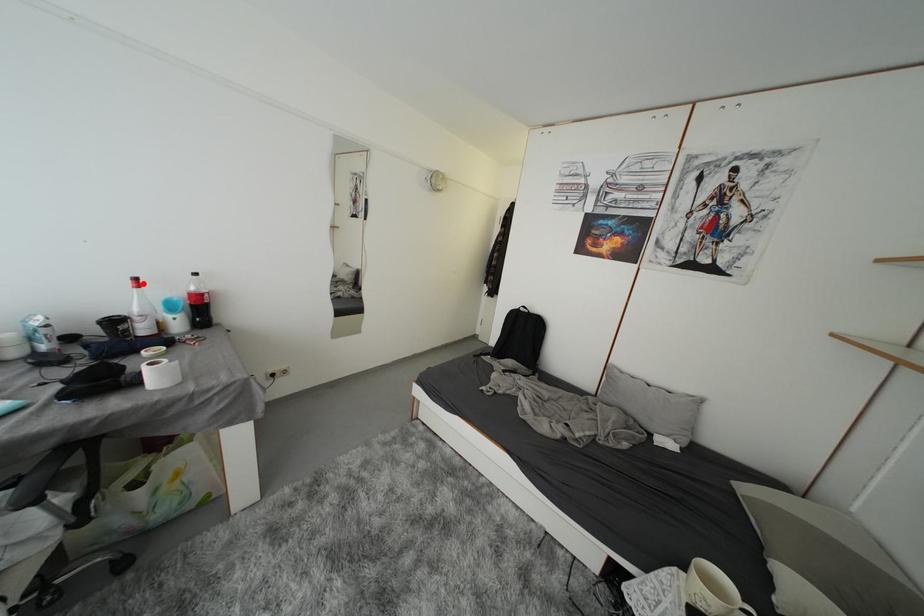
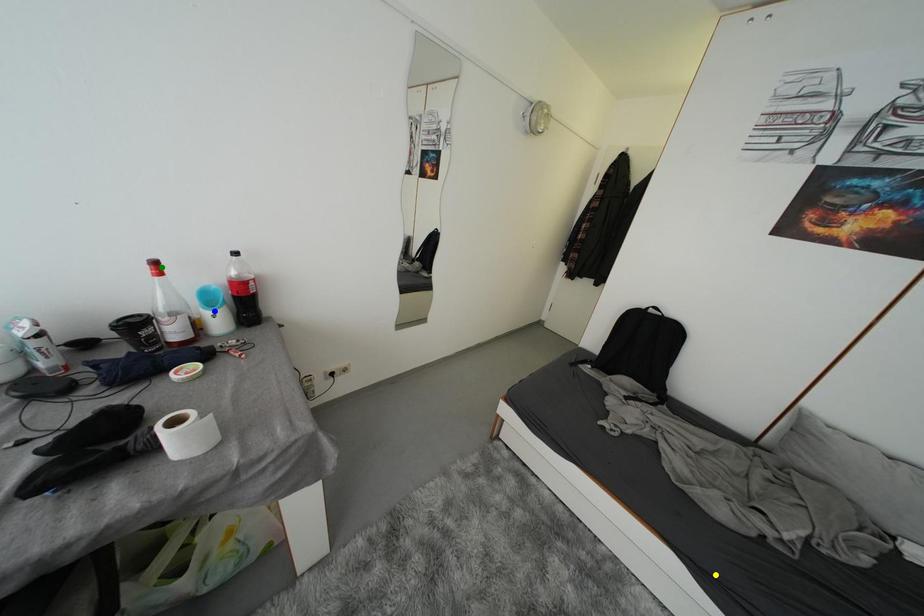
Question: I am providing you with two images of the same scene from different viewpoints. A red point is marked on the first image. You are given multiple points on the second image. Which point in image 2 is actually the same real-world point as the red point in image 1?

Choices:
 (A) yellow point
 (B) green point
 (C) blue point

Answer: (B)